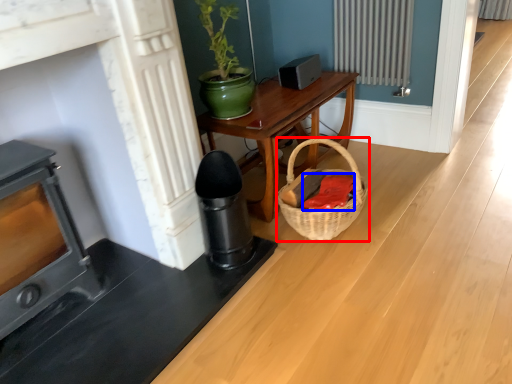
Question: Which point is further to the camera, basket (highlighted by a red box) or material (highlighted by a blue box)?

Choices:
 (A) basket
 (B) material

Answer: (B)